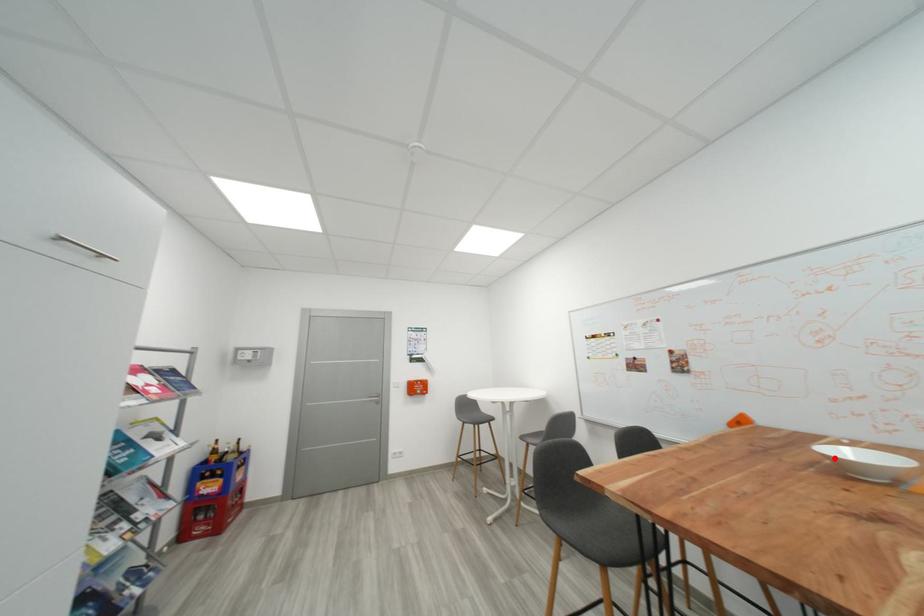
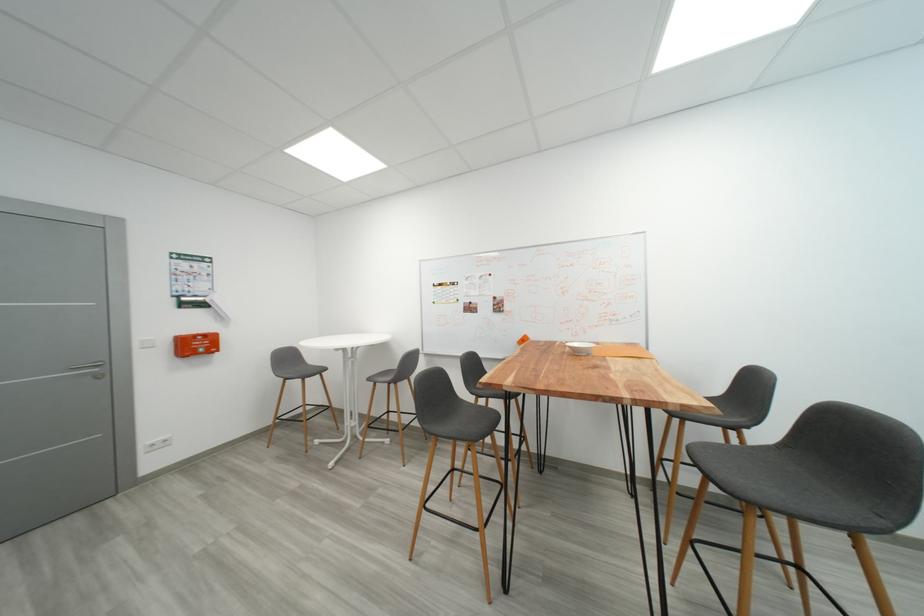
Where in the second image is the point corresponding to the highlighted location from the first image?

(578, 350)